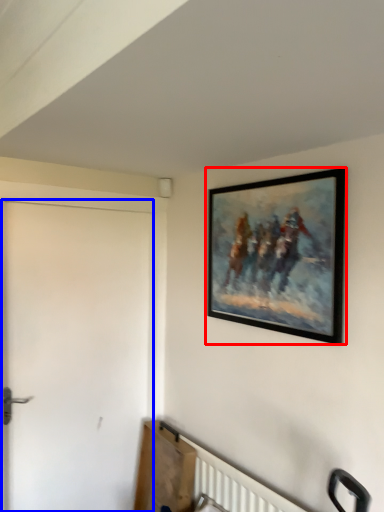
Question: Which of the following is the closest to the observer, picture frame (highlighted by a red box) or door (highlighted by a blue box)?

Choices:
 (A) picture frame
 (B) door

Answer: (A)